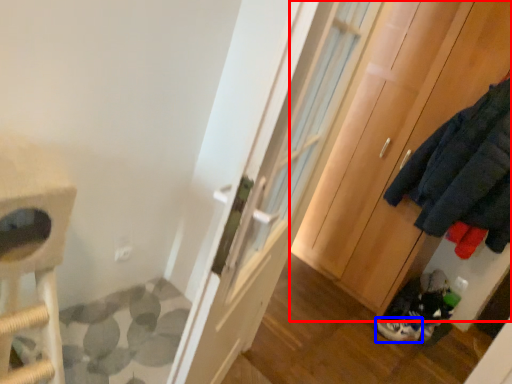
Question: Which object appears closest to the camera in this image, cabinetry (highlighted by a red box) or footwear (highlighted by a blue box)?

Choices:
 (A) cabinetry
 (B) footwear

Answer: (A)